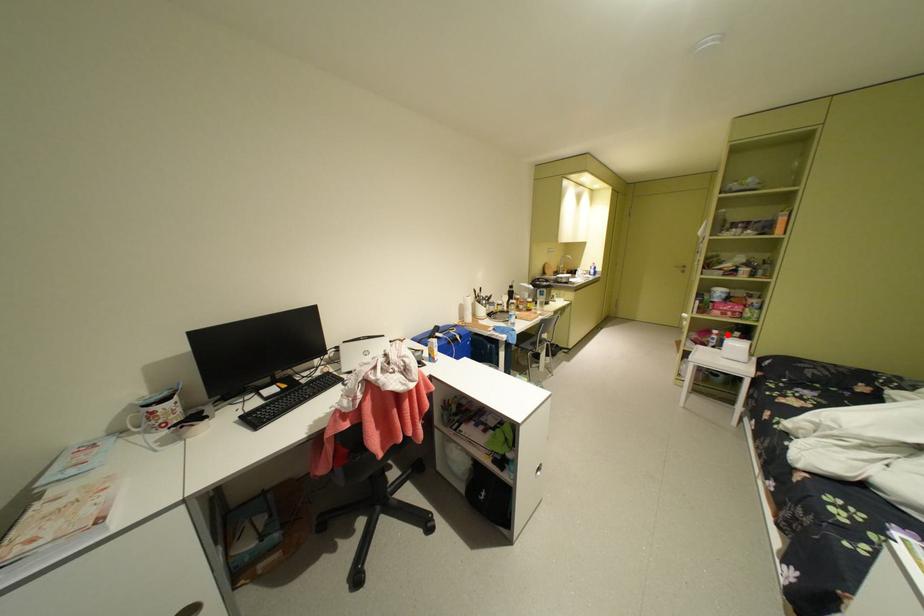
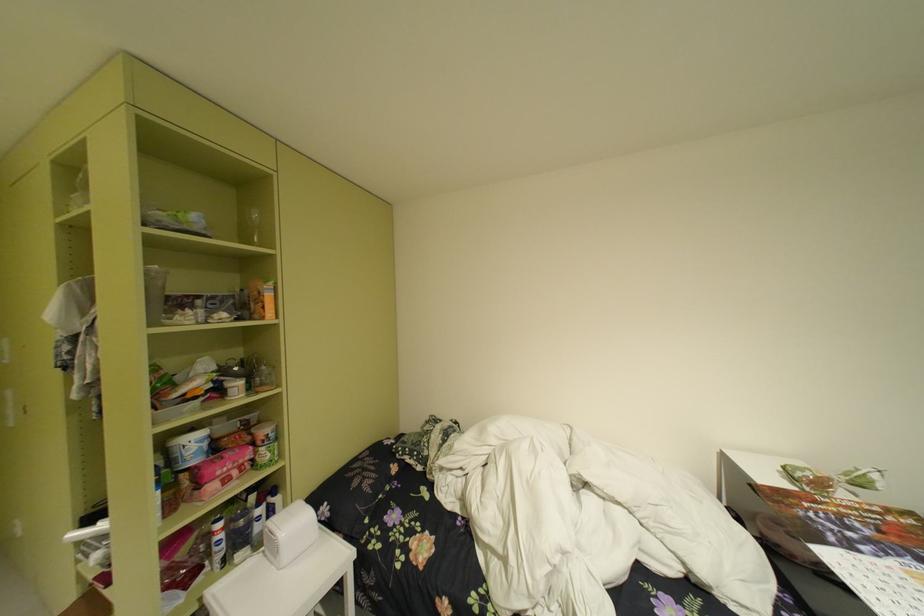
Locate, in the second image, the point that corresponds to the highlighted location in the first image.

(235, 528)